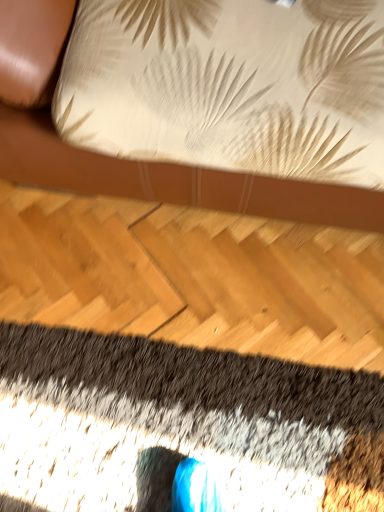
The image size is (384, 512). Describe the element at coordinates (180, 426) in the screenshot. I see `gravel textured carpet at lower center` at that location.

This screenshot has width=384, height=512. I want to click on gravel textured carpet at lower center, so click(180, 426).

The width and height of the screenshot is (384, 512). I want to click on gravel textured carpet at lower center, so click(x=180, y=426).